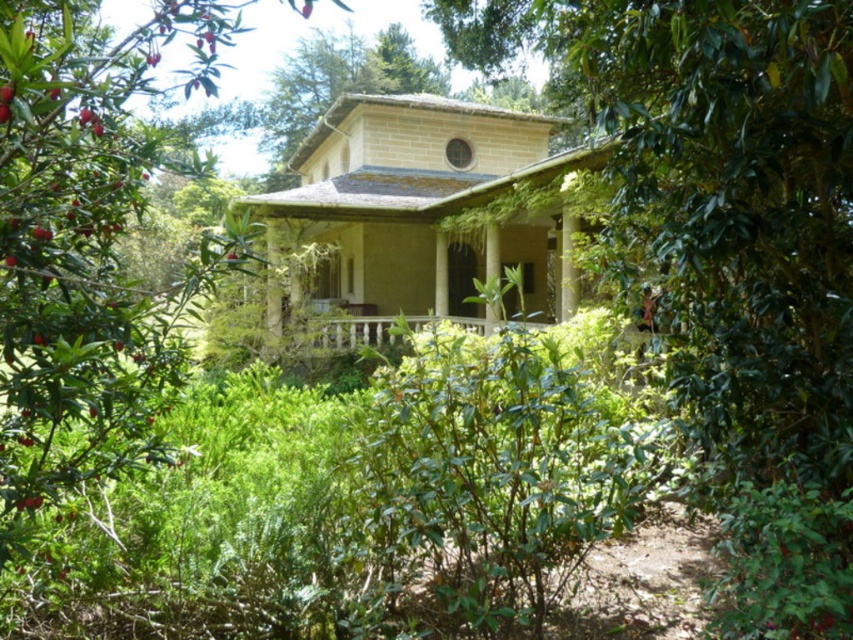
You are standing in front of the secluded house and want to take a photo that includes both the point at coordinates (695, 442) and the point at (32, 211). Based on their positions, which point will appear closer to the camera in the photo?

Point (32, 211) will appear closer to the camera in the photo because it is physically closer to the viewer than point (695, 442), which is further away.

In the scene shown: You are standing at the camera position and want to reach the point marked as point (x=120, y=412). Can you estimate how far you need to walk to get there?

The distance between point (x=120, y=412) and the camera is 3.48 meters, so you need to walk approximately 3.48 meters to reach it.

You are standing in front of the secluded house and want to take a photo of both the green leafy tree at center and the wooden porch at center. Which object should you focus on first to ensure both are in the frame?

You should focus on the green leafy tree at center first because it is taller than the wooden porch at center, so adjusting the camera angle to include its full height will naturally include the shorter wooden porch at center in the frame as well.